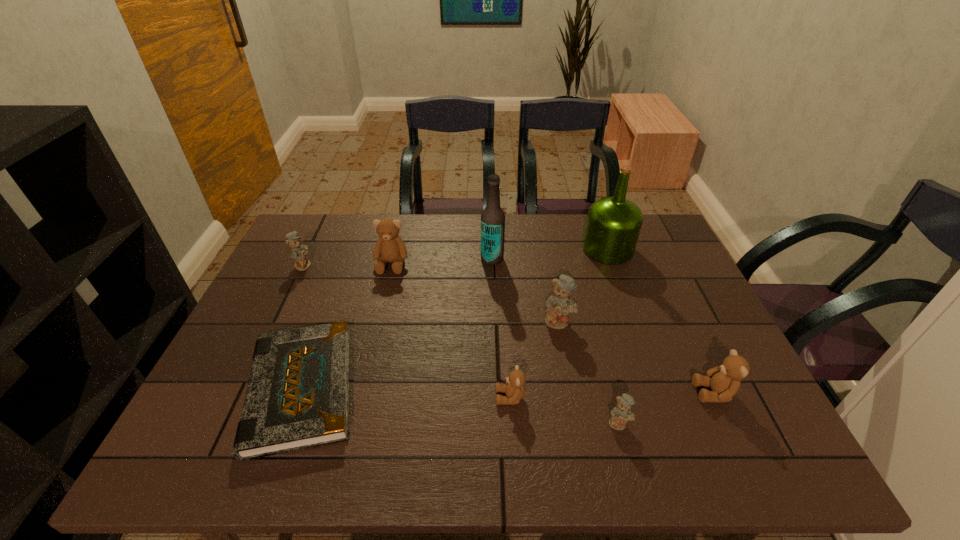
This screenshot has width=960, height=540. In order to click on the rightmost object in this screenshot , I will do `click(724, 380)`.

Where is `the smallest brown teddy bear`? This screenshot has width=960, height=540. the smallest brown teddy bear is located at coordinates (515, 390).

Find the location of `the second brown teddy bear from right to left`. the second brown teddy bear from right to left is located at coordinates (515, 390).

Locate an element on the screen. the rightmost blue teddy bear is located at coordinates (621, 414).

Locate an element on the screen. the seventh object from left to right is located at coordinates (621, 414).

You are a GUI agent. You are given a task and a screenshot of the screen. Output one action in this format:
    pyautogui.click(x=<x>, y=<y>)
    Task: Click on the notebook
    This screenshot has height=540, width=960.
    Given the screenshot: What is the action you would take?
    pyautogui.click(x=297, y=397)

The width and height of the screenshot is (960, 540). I want to click on blank space located on the left of the second object from right to left, so click(x=477, y=249).

Locate an element on the screen. The width and height of the screenshot is (960, 540). vacant space located on the side of the beer bottle with the label is located at coordinates (440, 259).

Locate an element on the screen. This screenshot has width=960, height=540. blank space located on the side of the beer bottle with the label is located at coordinates (379, 259).

Locate an element on the screen. free space located 0.300m on the side of the beer bottle with the label is located at coordinates (385, 259).